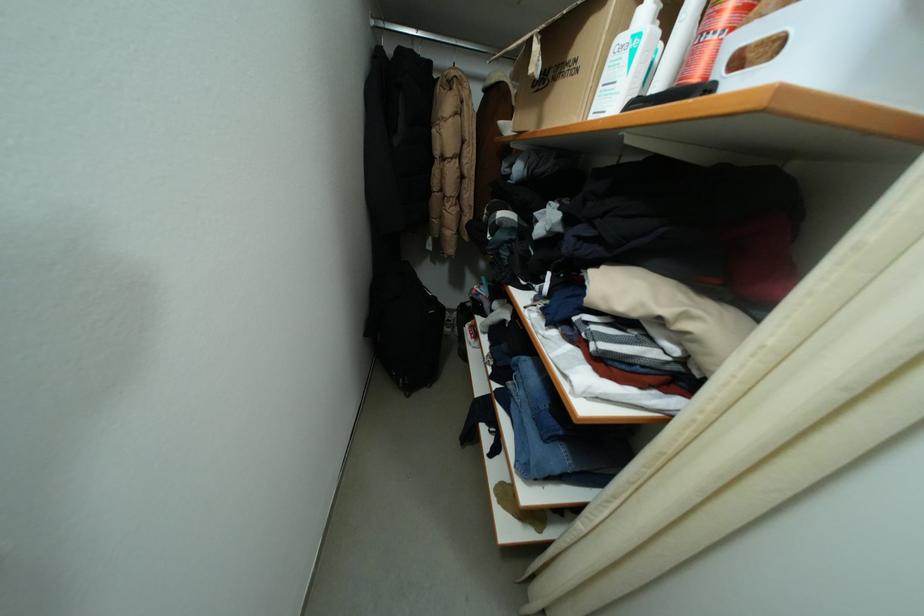
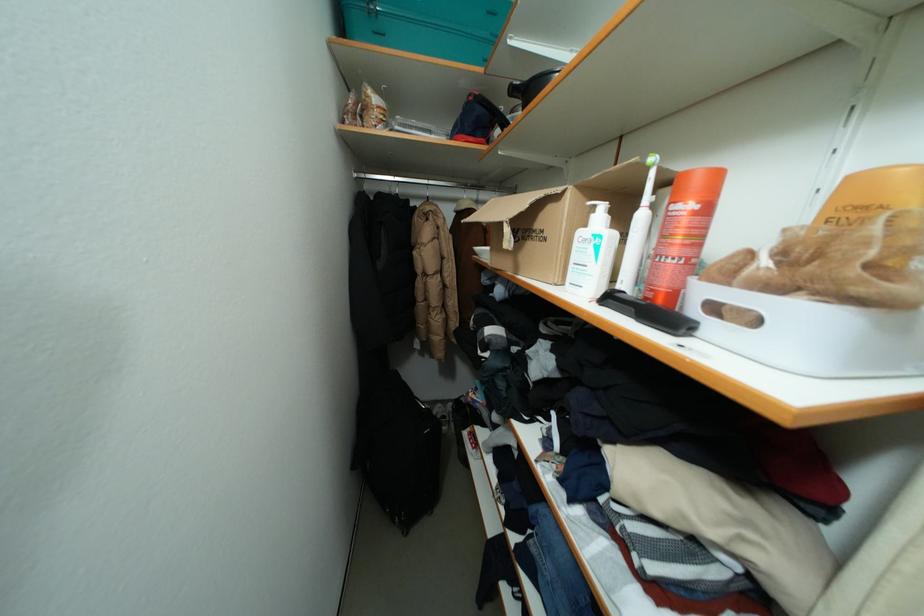
Question: The images are taken continuously from a first-person perspective. In which direction are you moving?

Choices:
 (A) Left
 (B) Right
 (C) Forward
 (D) Backward

Answer: (A)